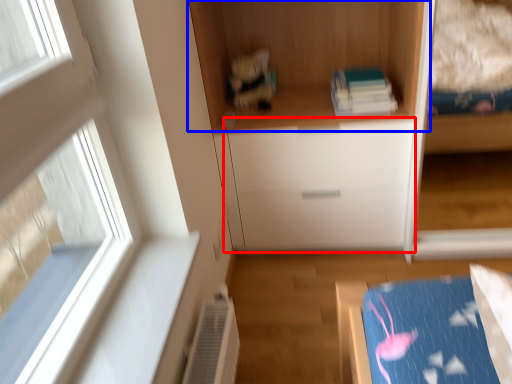
Question: Which object appears closest to the camera in this image, drawer (highlighted by a red box) or cupboard (highlighted by a blue box)?

Choices:
 (A) drawer
 (B) cupboard

Answer: (B)